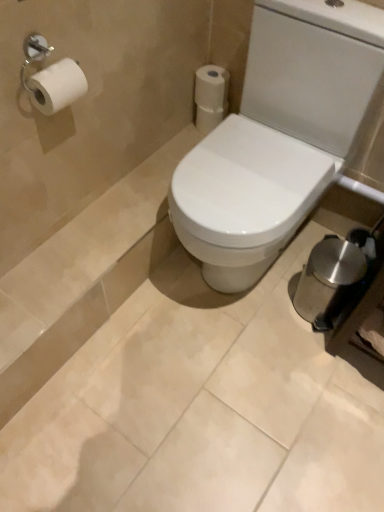
Question: Is point (203, 130) positioned closer to the camera than point (289, 230)?

Choices:
 (A) closer
 (B) farther

Answer: (B)

Question: In terms of height, does white matte toilet paper at upper center, arranged as the first toilet paper when viewed from the back, look taller or shorter compared to white glossy toilet at center?

Choices:
 (A) short
 (B) tall

Answer: (A)

Question: Which object is the farthest from the white matte toilet paper at upper center, acting as the 2th toilet paper starting from the front?

Choices:
 (A) white glossy toilet at center
 (B) white matte toilet paper at upper right, placed as the 1th toilet paper when sorted from front to back

Answer: (A)

Question: Estimate the real-world distances between objects in this image. Which object is closer to the white matte toilet paper at upper center, acting as the 2th toilet paper starting from the front?

Choices:
 (A) white matte toilet paper at upper right, positioned as the 2th toilet paper in back-to-front order
 (B) white glossy toilet at center

Answer: (A)